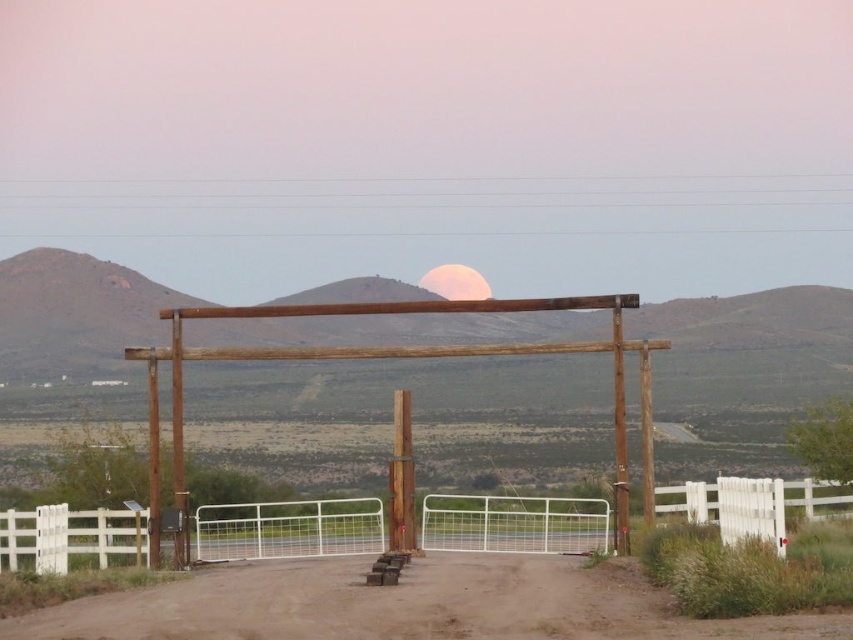
You are standing at the point marked by point (408, 605) in the image. What is the terrain like under your feet?

The terrain under your feet at point (408, 605) is dirt track at center.